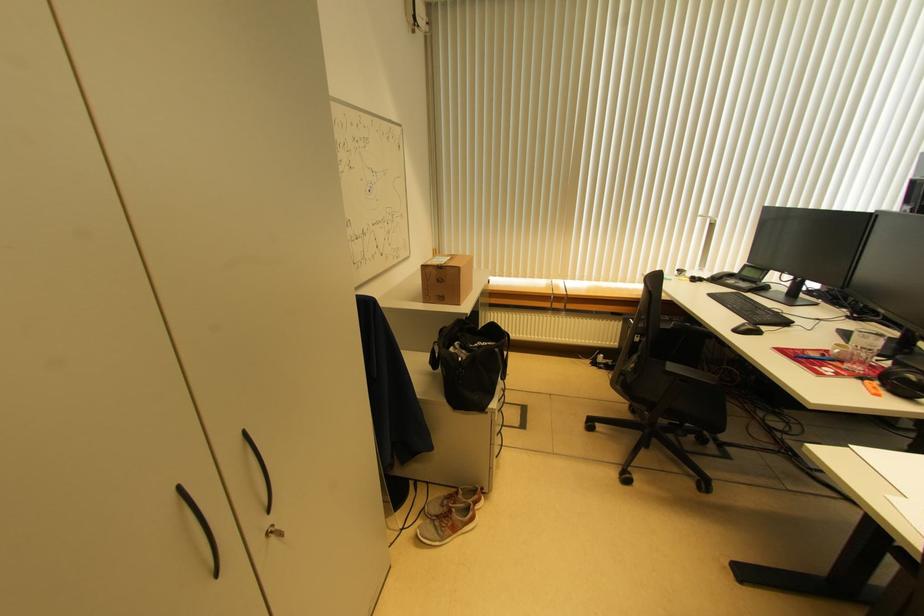
This screenshot has height=616, width=924. What do you see at coordinates (446, 524) in the screenshot?
I see `a grey and orange shoe` at bounding box center [446, 524].